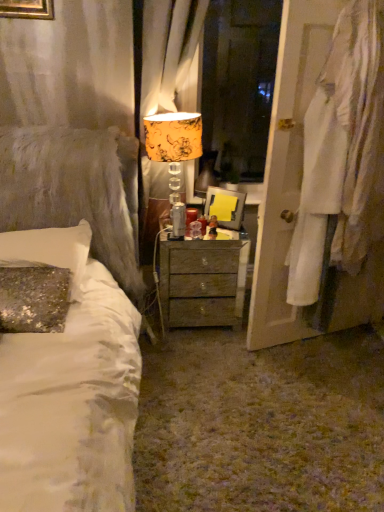
The width and height of the screenshot is (384, 512). I want to click on wooden nightstand at center, so click(203, 281).

Describe the element at coordinates (286, 168) in the screenshot. I see `white fabric at right` at that location.

Where is `white fabric at right`? Image resolution: width=384 pixels, height=512 pixels. white fabric at right is located at coordinates (286, 168).

Measure the distance between point (165, 143) and camera.

Point (165, 143) and camera are 6.52 feet apart.

The height and width of the screenshot is (512, 384). What do you see at coordinates (173, 137) in the screenshot? I see `yellow floral fabric lampshade at center` at bounding box center [173, 137].

Find the location of a particular element. This screenshot has width=384, height=512. sequined fabric pillow at left is located at coordinates 51,250.

Where is `wooden nightstand at center`? This screenshot has height=512, width=384. wooden nightstand at center is located at coordinates (203, 281).

Considering the relative positions of orange floral fabric curtain at upper center and yellow floral fabric lampshade at center in the image provided, is orange floral fabric curtain at upper center to the left or to the right of yellow floral fabric lampshade at center?

orange floral fabric curtain at upper center is to the right of yellow floral fabric lampshade at center.

Is orange floral fabric curtain at upper center taller than yellow floral fabric lampshade at center?

Indeed, orange floral fabric curtain at upper center has a greater height compared to yellow floral fabric lampshade at center.

Consider the image. Are orange floral fabric curtain at upper center and yellow floral fabric lampshade at center far apart?

They are positioned close to each other.

Which is nearer, (186, 54) or (193, 119)?

Point (186, 54) is positioned farther from the camera compared to point (193, 119).

Which is correct: matte plastic picture frame at center is inside wooden nightstand at center, or outside of it?

matte plastic picture frame at center is outside wooden nightstand at center.

Between matte plastic picture frame at center and wooden nightstand at center, which one has more height?

wooden nightstand at center.

Is point (207, 202) farther from camera compared to point (220, 298)?

No, (207, 202) is closer to viewer.

Is matte plastic picture frame at center to the left of white fabric at right from the viewer's perspective?

Yes.

Is matte plastic picture frame at center turned away from white fabric at right?

No, white fabric at right is not at the back of matte plastic picture frame at center.

Considering the sizes of objects matte plastic picture frame at center and white fabric at right in the image provided, who is taller, matte plastic picture frame at center or white fabric at right?

Result: Standing taller between the two is white fabric at right.

From the image's perspective, who appears lower, matte plastic picture frame at center or white fabric at right?

matte plastic picture frame at center, from the image's perspective.

Looking at this image, considering the sizes of matte plastic picture frame at center and sequined fabric pillow at left in the image, is matte plastic picture frame at center wider or thinner than sequined fabric pillow at left?

In the image, matte plastic picture frame at center appears to be more narrow than sequined fabric pillow at left.

Does matte plastic picture frame at center come behind sequined fabric pillow at left?

Yes, matte plastic picture frame at center is behind sequined fabric pillow at left.

Is matte plastic picture frame at center to the right of sequined fabric pillow at left from the viewer's perspective?

Correct, you'll find matte plastic picture frame at center to the right of sequined fabric pillow at left.

Looking at this image, does orange floral fabric curtain at upper center appear on the left side of white fabric at right?

Yes, orange floral fabric curtain at upper center is to the left of white fabric at right.

Between orange floral fabric curtain at upper center and white fabric at right, which one has smaller width?

With smaller width is white fabric at right.

Is orange floral fabric curtain at upper center completely or partially outside of white fabric at right?

Yes.

Looking at the image, does orange floral fabric curtain at upper center seem bigger or smaller compared to white fabric at right?

orange floral fabric curtain at upper center is smaller than white fabric at right.

Considering the sizes of objects sequined fabric pillow at left and wooden nightstand at center in the image provided, who is taller, sequined fabric pillow at left or wooden nightstand at center?

wooden nightstand at center is taller.

How different are the orientations of sequined fabric pillow at left and wooden nightstand at center in degrees?

The facing directions of sequined fabric pillow at left and wooden nightstand at center are 0.312 degrees apart.

Locate an element on the screen. pillow in front of the wooden nightstand at center is located at coordinates (51, 250).

Considering the sizes of objects white fabric at right and yellow floral fabric lampshade at center in the image provided, who is taller, white fabric at right or yellow floral fabric lampshade at center?

white fabric at right.

Is white fabric at right in contact with yellow floral fabric lampshade at center?

They are not placed beside each other.

Which is correct: white fabric at right is inside yellow floral fabric lampshade at center, or outside of it?

white fabric at right is not enclosed by yellow floral fabric lampshade at center.

From the image's perspective, which is below, white fabric at right or yellow floral fabric lampshade at center?

white fabric at right, from the image's perspective.

I want to click on table lamp below the orange floral fabric curtain at upper center (from a real-world perspective), so click(173, 137).

This screenshot has width=384, height=512. What are the coordinates of `picture frame located above the wooden nightstand at center (from a real-world perspective)` in the screenshot? It's located at [225, 207].

Based on the photo, from the image, which object appears to be nearer to yellow floral fabric lampshade at center, wooden nightstand at center or orange floral fabric curtain at upper center?

Based on the image, orange floral fabric curtain at upper center appears to be nearer to yellow floral fabric lampshade at center.

Which object lies nearer to the anchor point yellow floral fabric lampshade at center, orange floral fabric curtain at upper center or matte plastic picture frame at center?

orange floral fabric curtain at upper center is positioned closer to the anchor yellow floral fabric lampshade at center.

From the picture: Considering their positions, is yellow floral fabric lampshade at center positioned further to wooden nightstand at center than sequined fabric pillow at left?

sequined fabric pillow at left is positioned further to the anchor wooden nightstand at center.

Based on their spatial positions, is orange floral fabric curtain at upper center or white fabric at right closer to matte plastic picture frame at center?

Among the two, white fabric at right is located nearer to matte plastic picture frame at center.

Which object lies nearer to the anchor point yellow floral fabric lampshade at center, orange floral fabric curtain at upper center or sequined fabric pillow at left?

orange floral fabric curtain at upper center is positioned closer to the anchor yellow floral fabric lampshade at center.

Estimate the real-world distances between objects in this image. Which object is closer to white fabric at right, wooden nightstand at center or matte plastic picture frame at center?

wooden nightstand at center is closer to white fabric at right.

Estimate the real-world distances between objects in this image. Which object is further from matte plastic picture frame at center, wooden nightstand at center or sequined fabric pillow at left?

sequined fabric pillow at left is positioned further to the anchor matte plastic picture frame at center.

Which object lies further to the anchor point matte plastic picture frame at center, wooden nightstand at center or orange floral fabric curtain at upper center?

orange floral fabric curtain at upper center lies further to matte plastic picture frame at center than the other object.

Identify the location of curtain between sequined fabric pillow at left and wooden nightstand at center. This screenshot has width=384, height=512. (168, 53).

At what (x,y) coordinates should I click in order to perform the action: click on table lamp between sequined fabric pillow at left and wooden nightstand at center from left to right. Please return your answer as a coordinate pair (x, y). The height and width of the screenshot is (512, 384). Looking at the image, I should click on (173, 137).

Find the location of a particular element. Image resolution: width=384 pixels, height=512 pixels. table lamp between sequined fabric pillow at left and orange floral fabric curtain at upper center in the horizontal direction is located at coordinates (173, 137).

Where is `nightstand situated between sequined fabric pillow at left and matte plastic picture frame at center from left to right`? The height and width of the screenshot is (512, 384). nightstand situated between sequined fabric pillow at left and matte plastic picture frame at center from left to right is located at coordinates (203, 281).